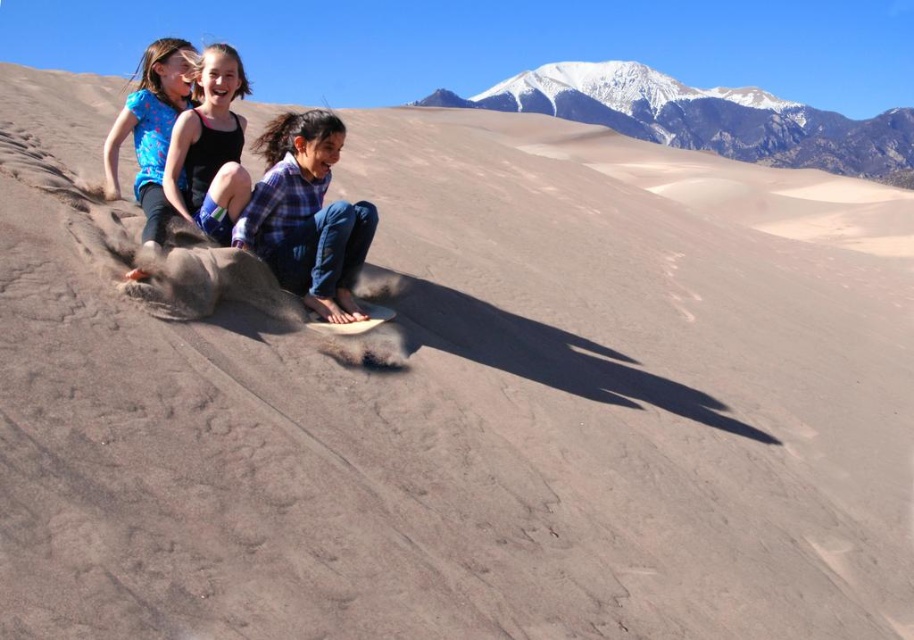
Question: Among these objects, which one is farthest from the camera?

Choices:
 (A) snowy mountain at upper center
 (B) matte blue shorts at center
 (C) matte blue shirt at upper left

Answer: (A)

Question: Is snowy mountain at upper center bigger than matte blue shorts at center?

Choices:
 (A) no
 (B) yes

Answer: (B)

Question: Is snowy mountain at upper center behind matte blue shorts at center?

Choices:
 (A) yes
 (B) no

Answer: (A)

Question: Which of the following is the farthest from the observer?

Choices:
 (A) matte blue shirt at upper left
 (B) blue plaid shirt at center
 (C) snowy mountain at upper center
 (D) matte blue shorts at center

Answer: (C)

Question: Can you confirm if snowy mountain at upper center is bigger than blue plaid shirt at center?

Choices:
 (A) yes
 (B) no

Answer: (A)

Question: Which object is closer to the camera taking this photo?

Choices:
 (A) blue plaid shirt at center
 (B) snowy mountain at upper center

Answer: (A)